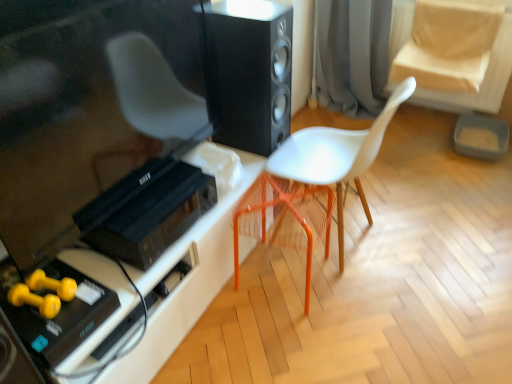
Question: Is black plastic stereo at lower left thinner than gray fabric curtain at upper center?

Choices:
 (A) no
 (B) yes

Answer: (B)

Question: Is black plastic stereo at lower left shorter than gray fabric curtain at upper center?

Choices:
 (A) no
 (B) yes

Answer: (B)

Question: Is black plastic stereo at lower left oriented away from gray fabric curtain at upper center?

Choices:
 (A) yes
 (B) no

Answer: (B)

Question: From the image's perspective, is black plastic stereo at lower left on gray fabric curtain at upper center?

Choices:
 (A) yes
 (B) no

Answer: (B)

Question: From a real-world perspective, is black plastic stereo at lower left below gray fabric curtain at upper center?

Choices:
 (A) yes
 (B) no

Answer: (B)

Question: Considering the positions of point (119, 201) and point (309, 273), is point (119, 201) closer or farther from the camera than point (309, 273)?

Choices:
 (A) farther
 (B) closer

Answer: (B)

Question: Is black plastic stereo at lower left taller or shorter than orange plastic swivel chair at center?

Choices:
 (A) short
 (B) tall

Answer: (A)

Question: Relative to orange plastic swivel chair at center, is black plastic stereo at lower left in front or behind?

Choices:
 (A) front
 (B) behind

Answer: (A)

Question: Do you think black plastic stereo at lower left is within orange plastic swivel chair at center, or outside of it?

Choices:
 (A) outside
 (B) inside

Answer: (A)

Question: From their relative heights in the image, would you say orange plastic swivel chair at center is taller or shorter than gray fabric curtain at upper center?

Choices:
 (A) tall
 (B) short

Answer: (B)

Question: From a real-world perspective, is orange plastic swivel chair at center positioned above or below gray fabric curtain at upper center?

Choices:
 (A) above
 (B) below

Answer: (B)

Question: In the image, is orange plastic swivel chair at center on the left side or the right side of gray fabric curtain at upper center?

Choices:
 (A) right
 (B) left

Answer: (B)

Question: Is point (269, 183) positioned closer to the camera than point (384, 41)?

Choices:
 (A) farther
 (B) closer

Answer: (B)

Question: From a real-world perspective, is black matte speaker at center above or below orange plastic swivel chair at center?

Choices:
 (A) above
 (B) below

Answer: (A)

Question: Is black matte speaker at center in front of or behind orange plastic swivel chair at center in the image?

Choices:
 (A) behind
 (B) front

Answer: (A)